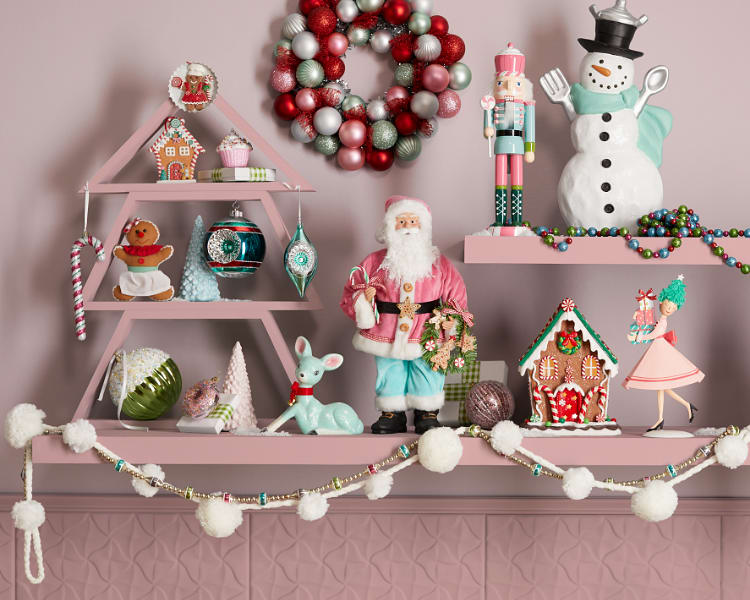
What are the coordinates of `wall` in the screenshot? It's located at (232, 54).